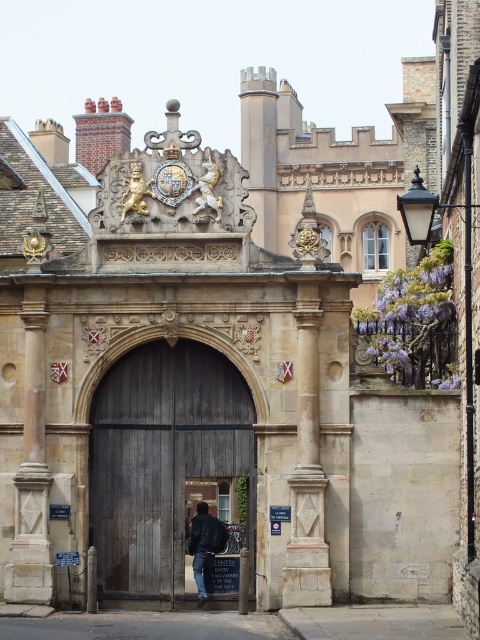
Who is more distant from viewer, (x=105, y=396) or (x=225, y=536)?

Positioned behind is point (x=105, y=396).

Looking at this image, can you confirm if wooden gate at center is smaller than dark blue jacket at center?

Actually, wooden gate at center might be larger than dark blue jacket at center.

Who is more forward, (x=187, y=400) or (x=211, y=536)?

Point (x=187, y=400) is in front.

Where is `wooden gate at center`? wooden gate at center is located at coordinates (166, 461).

Measure the distance between wooden gate at center and purple wisteria at upper right.

The distance of wooden gate at center from purple wisteria at upper right is 34.81 feet.

Is wooden gate at center below purple wisteria at upper right?

Yes.

Who is more distant from viewer, (x=163, y=432) or (x=405, y=385)?

Positioned behind is point (x=163, y=432).

Where is `wooden gate at center`? Image resolution: width=480 pixels, height=640 pixels. wooden gate at center is located at coordinates (166, 461).

Is purple wisteria at upper right above dark blue jacket at center?

Indeed, purple wisteria at upper right is positioned over dark blue jacket at center.

Can you confirm if purple wisteria at upper right is wider than dark blue jacket at center?

Yes.

Is point (452, 252) in front of point (203, 509)?

No, (452, 252) is further to viewer.

I want to click on purple wisteria at upper right, so click(415, 323).